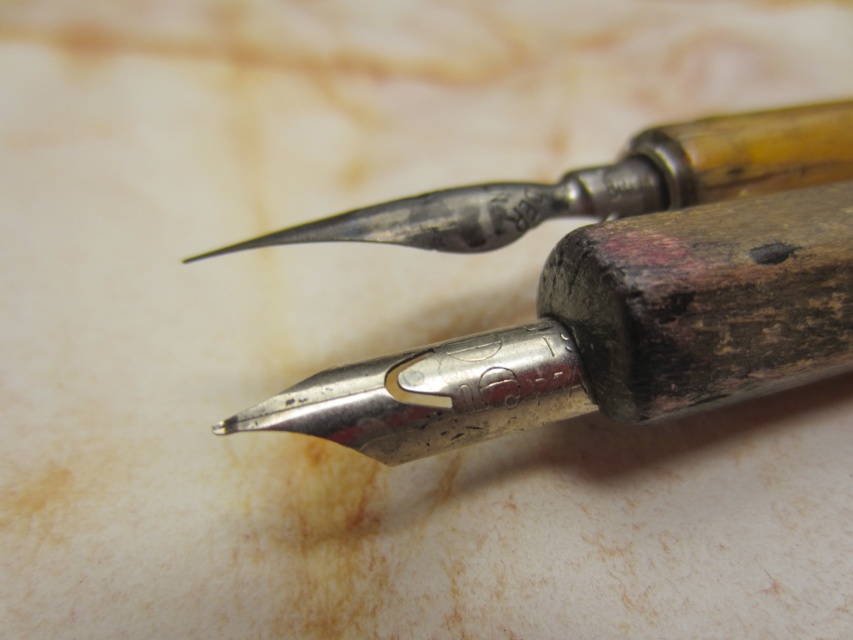
How distant is polished metal pen at center from polished silver pen at center?

They are 6.19 inches apart.

Between point (787, 301) and point (840, 106), which one is positioned in front?

Point (787, 301) is more forward.

Image resolution: width=853 pixels, height=640 pixels. I want to click on polished metal pen at center, so click(612, 332).